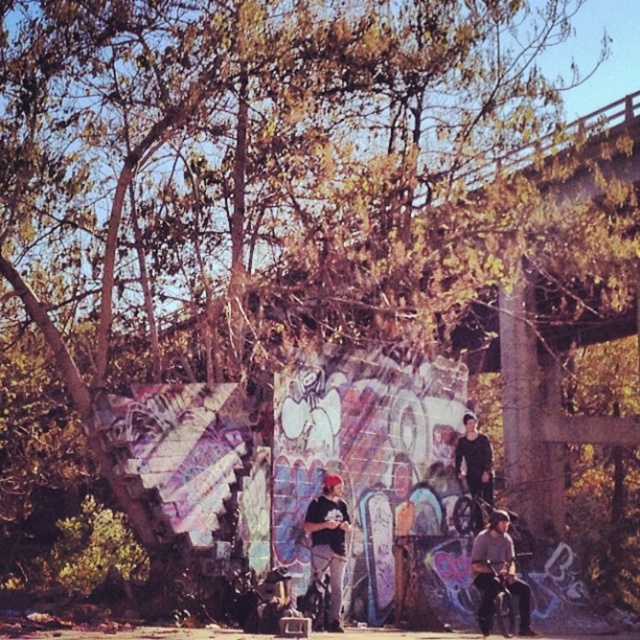
You are a photographer trying to capture a shot of the denim jacket at lower right and the matte black cap at center. Based on their heights, which object should you focus on first if you want to ensure both are in frame without adjusting your camera angle?

The denim jacket at lower right is taller than the matte black cap at center, so you should focus on the denim jacket at lower right first to ensure both are in frame.